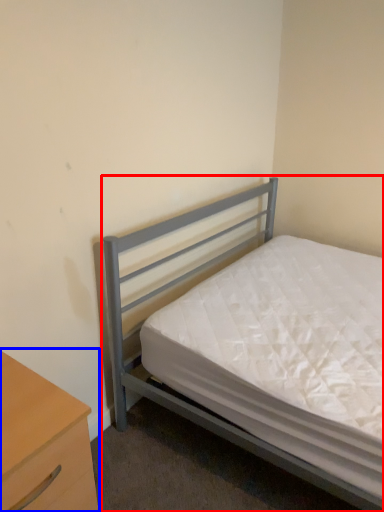
Question: Which object appears farthest to the camera in this image, bed (highlighted by a red box) or nightstand (highlighted by a blue box)?

Choices:
 (A) bed
 (B) nightstand

Answer: (A)